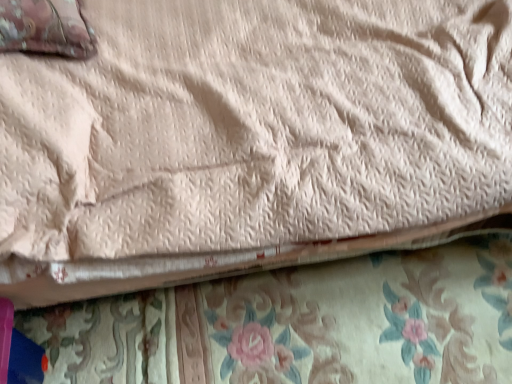
Question: Would you say floral fabric at lower center contains velvet-like pink pillow at upper left?

Choices:
 (A) no
 (B) yes

Answer: (A)

Question: From the image's perspective, would you say floral fabric at lower center is shown under velvet-like pink pillow at upper left?

Choices:
 (A) yes
 (B) no

Answer: (A)

Question: Is floral fabric at lower center looking in the opposite direction of velvet-like pink pillow at upper left?

Choices:
 (A) no
 (B) yes

Answer: (A)

Question: From a real-world perspective, is floral fabric at lower center under velvet-like pink pillow at upper left?

Choices:
 (A) yes
 (B) no

Answer: (A)

Question: Is the position of floral fabric at lower center more distant than that of velvet-like pink pillow at upper left?

Choices:
 (A) yes
 (B) no

Answer: (A)

Question: Can you confirm if floral fabric at lower center is taller than velvet-like pink pillow at upper left?

Choices:
 (A) yes
 (B) no

Answer: (B)

Question: From a real-world perspective, is velvet-like pink pillow at upper left below floral fabric at lower center?

Choices:
 (A) yes
 (B) no

Answer: (B)

Question: Is velvet-like pink pillow at upper left looking in the opposite direction of floral fabric at lower center?

Choices:
 (A) yes
 (B) no

Answer: (B)

Question: From a real-world perspective, is velvet-like pink pillow at upper left on floral fabric at lower center?

Choices:
 (A) no
 (B) yes

Answer: (B)

Question: Can you confirm if velvet-like pink pillow at upper left is wider than floral fabric at lower center?

Choices:
 (A) no
 (B) yes

Answer: (A)

Question: Can you see velvet-like pink pillow at upper left touching floral fabric at lower center?

Choices:
 (A) no
 (B) yes

Answer: (A)

Question: Is the depth of velvet-like pink pillow at upper left greater than that of floral fabric at lower center?

Choices:
 (A) yes
 (B) no

Answer: (B)

Question: In the image, is velvet-like pink pillow at upper left positioned in front of or behind floral fabric at lower center?

Choices:
 (A) behind
 (B) front

Answer: (B)